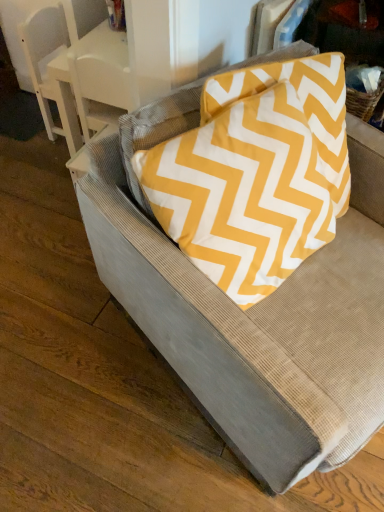
Question: Does white glossy table at upper left come in front of textured gray cushion at center?

Choices:
 (A) no
 (B) yes

Answer: (A)

Question: From a real-world perspective, is white glossy table at upper left below textured gray cushion at center?

Choices:
 (A) yes
 (B) no

Answer: (A)

Question: Considering the relative sizes of white glossy table at upper left and textured gray cushion at center in the image provided, is white glossy table at upper left thinner than textured gray cushion at center?

Choices:
 (A) no
 (B) yes

Answer: (B)

Question: Is white glossy table at upper left to the left of textured gray cushion at center from the viewer's perspective?

Choices:
 (A) no
 (B) yes

Answer: (B)

Question: From the image's perspective, is white glossy table at upper left located above textured gray cushion at center?

Choices:
 (A) yes
 (B) no

Answer: (A)

Question: Considering the positions of yellow zigzag fabric pillow at upper right and white glossy table at upper left in the image, is yellow zigzag fabric pillow at upper right wider or thinner than white glossy table at upper left?

Choices:
 (A) wide
 (B) thin

Answer: (B)

Question: From the image's perspective, relative to white glossy table at upper left, is yellow zigzag fabric pillow at upper right above or below?

Choices:
 (A) above
 (B) below

Answer: (B)

Question: Looking at the image, does yellow zigzag fabric pillow at upper right seem bigger or smaller compared to white glossy table at upper left?

Choices:
 (A) small
 (B) big

Answer: (B)

Question: From a real-world perspective, is yellow zigzag fabric pillow at upper right above or below white glossy table at upper left?

Choices:
 (A) below
 (B) above

Answer: (B)

Question: In terms of height, does yellow zigzag fabric pillow at upper right look taller or shorter compared to textured gray cushion at center?

Choices:
 (A) short
 (B) tall

Answer: (A)

Question: Is yellow zigzag fabric pillow at upper right to the left or to the right of textured gray cushion at center in the image?

Choices:
 (A) right
 (B) left

Answer: (B)

Question: From a real-world perspective, is yellow zigzag fabric pillow at upper right above or below textured gray cushion at center?

Choices:
 (A) below
 (B) above

Answer: (B)

Question: Is point (301, 90) positioned closer to the camera than point (261, 371)?

Choices:
 (A) closer
 (B) farther

Answer: (B)

Question: From the image's perspective, is white glossy table at upper left located above or below textured gray cushion at center?

Choices:
 (A) below
 (B) above

Answer: (B)

Question: Considering the positions of white glossy table at upper left and textured gray cushion at center in the image, is white glossy table at upper left taller or shorter than textured gray cushion at center?

Choices:
 (A) tall
 (B) short

Answer: (B)